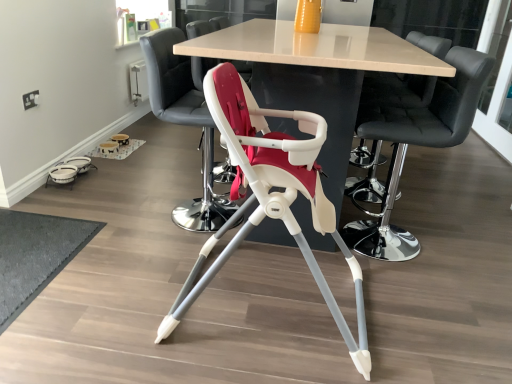
Identify the location of black leather bar stool at upper center, the second chair from the right. The width and height of the screenshot is (512, 384). (419, 145).

What do you see at coordinates (392, 94) in the screenshot? I see `smooth black bar stool at center, marked as the 4th chair in a left-to-right arrangement` at bounding box center [392, 94].

Describe the element at coordinates (35, 255) in the screenshot. I see `dark gray textured mat at lower left` at that location.

What do you see at coordinates (316, 48) in the screenshot?
I see `matte white table at center` at bounding box center [316, 48].

Identify the location of transparent glass door at upper right. This screenshot has width=512, height=384. (497, 106).

What do you see at coordinates (497, 106) in the screenshot? This screenshot has width=512, height=384. I see `transparent glass door at upper right` at bounding box center [497, 106].

How much space does matte white highchair at center, which appears as the 2th chair when viewed from the left, occupy vertically?

It is 34.56 inches.

Where is `black leather bar stool at upper center, the second chair from the right`? The image size is (512, 384). black leather bar stool at upper center, the second chair from the right is located at coordinates (419, 145).

Locate an element on the screen. the 3rd chair directly beneath the black leather bar stool at upper center, the second chair from the right (from a real-world perspective) is located at coordinates (271, 195).

Is point (455, 56) farther from viewer compared to point (362, 370)?

Yes, point (455, 56) is farther from viewer.

Which object is further away from the camera, black leather bar stool at upper center, the second chair from the right, or matte white highchair at center, which appears as the 2th chair when viewed from the left?

Positioned behind is black leather bar stool at upper center, the second chair from the right.

Is black leather bar stool at upper center, the second chair from the right, looking in the opposite direction of matte white highchair at center, which appears as the 2th chair when viewed from the left?

black leather bar stool at upper center, the second chair from the right, does not have its back to matte white highchair at center, which appears as the 2th chair when viewed from the left.

Considering the positions of objects white plastic highchair at center, the 4th chair positioned from the right, and dark gray textured mat at lower left in the image provided, who is more to the left, white plastic highchair at center, the 4th chair positioned from the right, or dark gray textured mat at lower left?

Positioned to the left is dark gray textured mat at lower left.

How many degrees apart are the facing directions of white plastic highchair at center, the 4th chair positioned from the right, and dark gray textured mat at lower left?

1.79 degrees.

From the picture: Is white plastic highchair at center, positioned as the first chair in left-to-right order, oriented towards dark gray textured mat at lower left?

No, white plastic highchair at center, positioned as the first chair in left-to-right order, is not oriented towards dark gray textured mat at lower left.

Are white plastic highchair at center, the 4th chair positioned from the right, and dark gray textured mat at lower left located far from each other?

That's not correct — white plastic highchair at center, the 4th chair positioned from the right, is a little close to dark gray textured mat at lower left.

Does transparent glass door at upper right lie in front of matte white table at center?

That is False.

Does point (493, 102) lie behind point (365, 59)?

Yes.

What are the coordinates of `table that is on the left side of transparent glass door at upper right` in the screenshot? It's located at (316, 48).

From a real-world perspective, is transparent glass door at upper right positioned over white plastic highchair at center, the 4th chair positioned from the right, based on gravity?

Yes, from a real-world perspective, transparent glass door at upper right is over white plastic highchair at center, the 4th chair positioned from the right

From the image's perspective, who appears lower, transparent glass door at upper right or white plastic highchair at center, the 4th chair positioned from the right?

white plastic highchair at center, the 4th chair positioned from the right, from the image's perspective.

Would you say transparent glass door at upper right contains white plastic highchair at center, the 4th chair positioned from the right?

No, white plastic highchair at center, the 4th chair positioned from the right, is not a part of transparent glass door at upper right.

Does transparent glass door at upper right come in front of white plastic highchair at center, the 4th chair positioned from the right?

No, it is not.

Where is `mat in front of the black leather bar stool at upper center, which is the third chair from left to right`? The height and width of the screenshot is (384, 512). mat in front of the black leather bar stool at upper center, which is the third chair from left to right is located at coordinates (35, 255).

Is the depth of black leather bar stool at upper center, the second chair from the right, less than that of dark gray textured mat at lower left?

No, black leather bar stool at upper center, the second chair from the right, is further to the viewer.

From the image's perspective, is black leather bar stool at upper center, which is the third chair from left to right, above dark gray textured mat at lower left?

Yes, from the image's perspective, black leather bar stool at upper center, which is the third chair from left to right, is above dark gray textured mat at lower left.

Relative to dark gray textured mat at lower left, is matte white table at center in front or behind?

In the image, matte white table at center appears in front of dark gray textured mat at lower left.

Consider the image. Would you say matte white table at center is to the left or to the right of dark gray textured mat at lower left in the picture?

matte white table at center is to the right of dark gray textured mat at lower left.

Does matte white table at center have a larger size compared to dark gray textured mat at lower left?

Yes, matte white table at center is bigger than dark gray textured mat at lower left.

Which is closer to the camera, (418, 56) or (46, 274)?

Point (418, 56).

Is dark gray textured mat at lower left thinner than transparent glass door at upper right?

No.

In terms of size, does dark gray textured mat at lower left appear bigger or smaller than transparent glass door at upper right?

In the image, dark gray textured mat at lower left appears to be smaller than transparent glass door at upper right.

Does point (24, 298) appear closer or farther from the camera than point (476, 111)?

Point (24, 298) is closer to the camera than point (476, 111).

Are dark gray textured mat at lower left and transparent glass door at upper right beside each other?

They are not placed beside each other.

Where is `chair below the black leather bar stool at upper center, the second chair from the right (from the image's perspective)`? This screenshot has width=512, height=384. chair below the black leather bar stool at upper center, the second chair from the right (from the image's perspective) is located at coordinates (271, 195).

Starting from the dark gray textured mat at lower left, which chair is the 2nd one behind? Please provide its 2D coordinates.

[(185, 121)]

Which object lies further to the anchor point black leather bar stool at upper center, the second chair from the right, white plastic highchair at center, positioned as the first chair in left-to-right order, or matte white highchair at center, acting as the 3th chair starting from the right?

The object further to black leather bar stool at upper center, the second chair from the right, is white plastic highchair at center, positioned as the first chair in left-to-right order.

Estimate the real-world distances between objects in this image. Which object is closer to matte white table at center, smooth black bar stool at center, placed as the first chair when sorted from right to left, or white plastic highchair at center, the 4th chair positioned from the right?

Based on the image, smooth black bar stool at center, placed as the first chair when sorted from right to left, appears to be nearer to matte white table at center.

From the picture: Considering their positions, is matte white table at center positioned further to matte white highchair at center, acting as the 3th chair starting from the right, than white plastic highchair at center, positioned as the first chair in left-to-right order?

matte white table at center is positioned further to the anchor matte white highchair at center, acting as the 3th chair starting from the right.

From the image, which object appears to be nearer to white plastic highchair at center, positioned as the first chair in left-to-right order, matte white highchair at center, acting as the 3th chair starting from the right, or smooth black bar stool at center, marked as the 4th chair in a left-to-right arrangement?

matte white highchair at center, acting as the 3th chair starting from the right, is closer to white plastic highchair at center, positioned as the first chair in left-to-right order.

Considering their positions, is black leather bar stool at upper center, which is the third chair from left to right, positioned further to transparent glass door at upper right than dark gray textured mat at lower left?

dark gray textured mat at lower left is further to transparent glass door at upper right.

Which object lies further to the anchor point smooth black bar stool at center, marked as the 4th chair in a left-to-right arrangement, transparent glass door at upper right or white plastic highchair at center, positioned as the first chair in left-to-right order?

transparent glass door at upper right is positioned further to the anchor smooth black bar stool at center, marked as the 4th chair in a left-to-right arrangement.

Considering their positions, is dark gray textured mat at lower left positioned further to transparent glass door at upper right than black leather bar stool at upper center, which is the third chair from left to right?

dark gray textured mat at lower left lies further to transparent glass door at upper right than the other object.

Estimate the real-world distances between objects in this image. Which object is further from matte white highchair at center, which appears as the 2th chair when viewed from the left, transparent glass door at upper right or black leather bar stool at upper center, which is the third chair from left to right?

Among the two, transparent glass door at upper right is located further to matte white highchair at center, which appears as the 2th chair when viewed from the left.

Image resolution: width=512 pixels, height=384 pixels. I want to click on table between dark gray textured mat at lower left and black leather bar stool at upper center, which is the third chair from left to right, from left to right, so click(316, 48).

In order to click on chair between black leather bar stool at upper center, which is the third chair from left to right, and transparent glass door at upper right from left to right in this screenshot , I will do `click(392, 94)`.

I want to click on chair between dark gray textured mat at lower left and matte white highchair at center, acting as the 3th chair starting from the right, in the horizontal direction, so click(185, 121).

The width and height of the screenshot is (512, 384). Find the location of `table between matte white highchair at center, acting as the 3th chair starting from the right, and black leather bar stool at upper center, the second chair from the right`. table between matte white highchair at center, acting as the 3th chair starting from the right, and black leather bar stool at upper center, the second chair from the right is located at coordinates (316, 48).